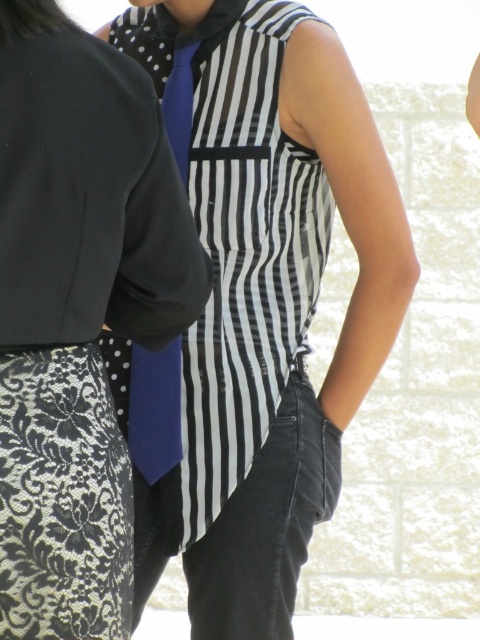
You are a photographer adjusting the lighting for a photoshoot. You notice the black lace skirt at lower left and the blue satin tie at center. Which of these items is positioned higher up in the image?

The black lace skirt at lower left is located above the blue satin tie at center, so it is positioned higher up in the image.

You are a fashion designer trying to decide whether to place a belt on the black lace skirt at lower left or the blue satin tie at center. Since the belt requires a certain amount of space, which item has a greater width to accommodate it?

The black lace skirt at lower left has a greater width than the blue satin tie at center, so the belt would fit better on the black lace skirt at lower left.

You are an artist trying to sketch the scene. You need to place the matte striped shirt at center in your drawing. What are the coordinates where you should position it?

The matte striped shirt at center should be positioned at coordinates 0.469 on the x axis and 0.552 on the y axis.